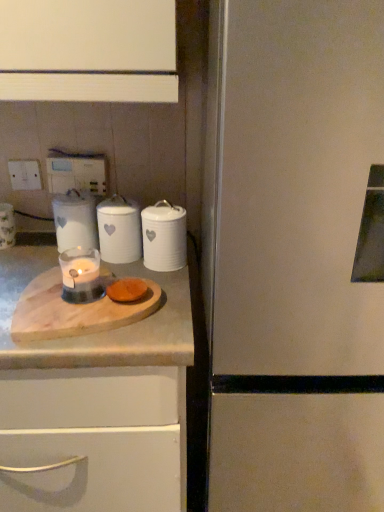
Locate an element on the screen. The height and width of the screenshot is (512, 384). free location above wooden cutting board at center, arranged as the first countertop when ordered from the bottom (from a real-world perspective) is located at coordinates (50, 288).